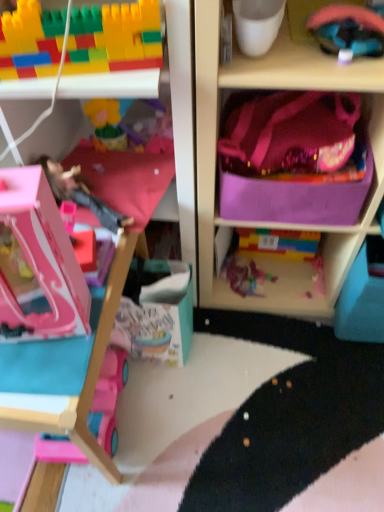
The width and height of the screenshot is (384, 512). I want to click on free space in front of pink plastic dollhouse at left, which appears as the 3th toy when viewed from the top, so click(x=29, y=378).